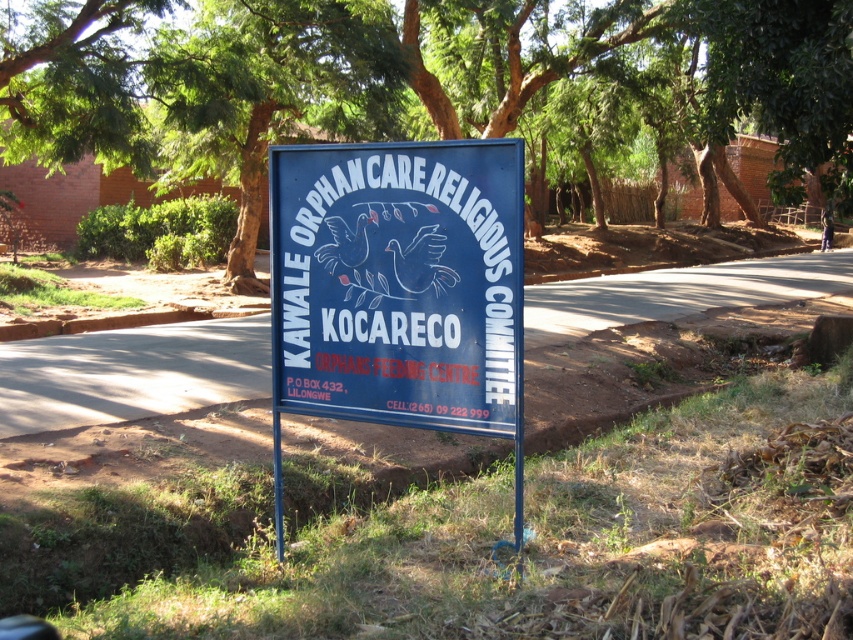
Looking at the scene, where is the green leafy tree at upper center in relation to the blue painted metal signboard at center?

The green leafy tree at upper center is located to the right of the blue painted metal signboard at center.

You are an artist planning to paint a landscape that includes the green leafy tree at upper center and the blue painted metal signboard at center. Which object should you make wider in your painting to stay true to the actual scene?

The green leafy tree at upper center should be made wider in the painting since its width surpasses that of the blue painted metal signboard at center in the actual scene.

You are standing in front of the signboard and want to place a sticker on the point that is closer to you. Which point should you choose between point (393, 83) and point (505, 180)?

Point (505, 180) is closer to you because it is in front of point (393, 83).